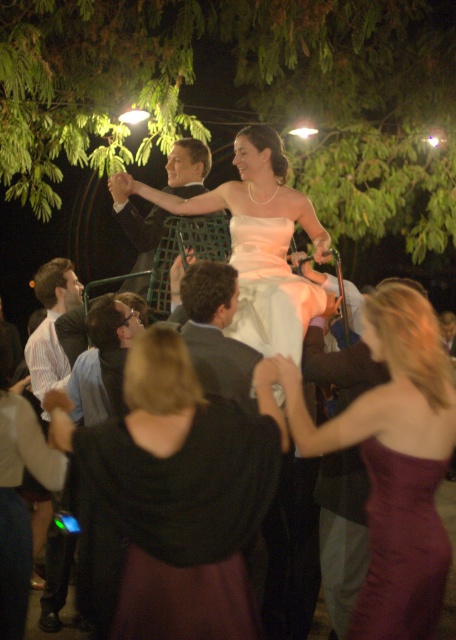
Question: Which point appears farthest from the camera in this image?

Choices:
 (A) (202, 144)
 (B) (397, 372)
 (C) (155, 394)
 (D) (154, 198)

Answer: (A)

Question: Which object is closer to the camera taking this photo?

Choices:
 (A) burgundy satin dress at lower right
 (B) shiny burgundy dress at center
 (C) peach satin dress at center

Answer: (A)

Question: Where is striped cotton shirt at left located in relation to shiny black suit at center in the image?

Choices:
 (A) above
 (B) below

Answer: (B)

Question: Considering the relative positions of striped cotton shirt at left and shiny black suit at center in the image provided, where is striped cotton shirt at left located with respect to shiny black suit at center?

Choices:
 (A) below
 (B) above

Answer: (A)

Question: Which of the following is the closest to the observer?

Choices:
 (A) (192, 608)
 (B) (378, 621)
 (C) (129, 225)
 (D) (288, 192)

Answer: (A)

Question: Can you confirm if burgundy satin dress at lower right is smaller than shiny black suit at center?

Choices:
 (A) yes
 (B) no

Answer: (A)